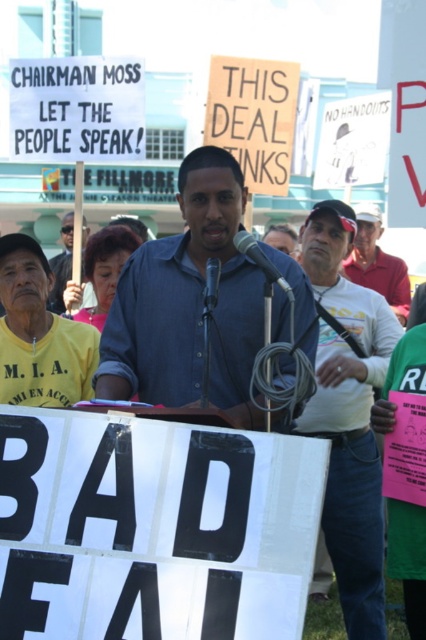
Question: Does blue denim shirt at center appear on the right side of matte blue shirt at center?

Choices:
 (A) no
 (B) yes

Answer: (B)

Question: Is blue denim shirt at center positioned before matte blue shirt at center?

Choices:
 (A) no
 (B) yes

Answer: (B)

Question: Which point is closer to the camera taking this photo?

Choices:
 (A) (63, 324)
 (B) (66, 250)
 (C) (204, 301)
 (D) (187, 168)

Answer: (C)

Question: Which is farther from the red shirt at center?

Choices:
 (A) yellow/yellowish fabric shirt at left
 (B) blue denim shirt at center
 (C) metallic/matte microphone at center
 (D) white cotton shirt at center

Answer: (C)

Question: Which of the following is the closest to the observer?

Choices:
 (A) red shirt at center
 (B) yellow/yellowish fabric shirt at left
 (C) metallic/matte microphone at center
 (D) matte blue shirt at center

Answer: (C)

Question: Is red shirt at center wider than metallic/matte microphone at center?

Choices:
 (A) yes
 (B) no

Answer: (A)